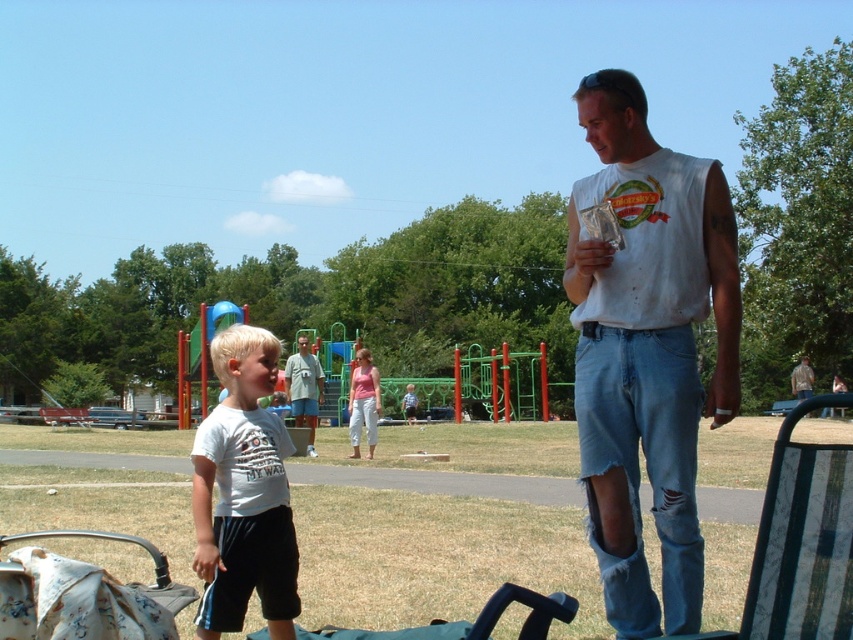
Does white cotton tank top at center have a larger size compared to white matte t-shirt at lower left?

Correct, white cotton tank top at center is larger in size than white matte t-shirt at lower left.

Can you confirm if white cotton tank top at center is positioned to the left of white matte t-shirt at lower left?

Incorrect, white cotton tank top at center is not on the left side of white matte t-shirt at lower left.

Which is behind, point (648, 216) or point (265, 413)?

Point (265, 413)

You are a GUI agent. You are given a task and a screenshot of the screen. Output one action in this format:
    pyautogui.click(x=<x>, y=<y>)
    Task: Click on the white cotton tank top at center
    
    Given the screenshot: What is the action you would take?
    pyautogui.click(x=647, y=349)

Between white matte t-shirt at lower left and light blue jeans at center, which one has less height?

With less height is light blue jeans at center.

Between white matte t-shirt at lower left and light blue jeans at center, which one is positioned lower?

light blue jeans at center is below.

Locate an element on the screen. The height and width of the screenshot is (640, 853). white matte t-shirt at lower left is located at coordinates (242, 493).

Who is positioned more to the right, white matte t-shirt at lower left or white fabric baby carriage at lower left?

white fabric baby carriage at lower left is more to the right.

Can you confirm if white matte t-shirt at lower left is shorter than white fabric baby carriage at lower left?

No.

Which is behind, point (274, 632) or point (567, 620)?

Point (274, 632)

This screenshot has height=640, width=853. I want to click on white matte t-shirt at lower left, so click(242, 493).